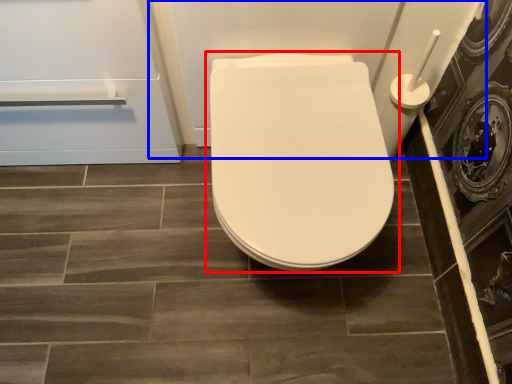
Question: Which object is closer to the camera taking this photo, toilet (highlighted by a red box) or bath (highlighted by a blue box)?

Choices:
 (A) toilet
 (B) bath

Answer: (A)